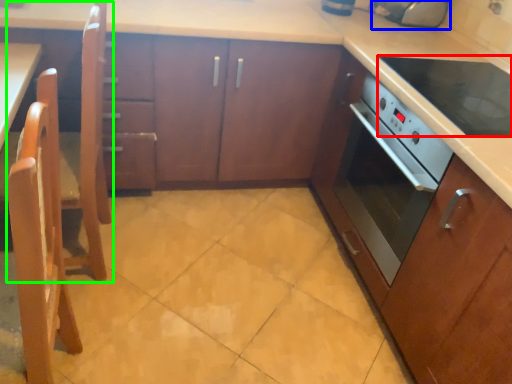
Question: Based on their relative distances, which object is nearer to kitchen appliance (highlighted by a red box)? Choose from appliance (highlighted by a blue box) and chair (highlighted by a green box).

Choices:
 (A) appliance
 (B) chair

Answer: (A)